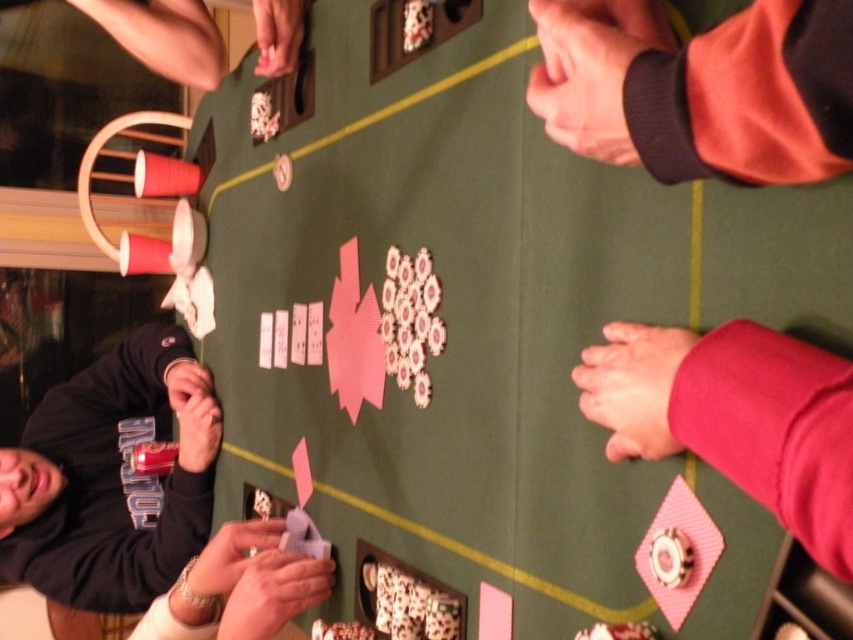
Does pink fabric hand at lower right come in front of smooth gray cards at lower center?

Yes, pink fabric hand at lower right is in front of smooth gray cards at lower center.

Is pink fabric hand at lower right smaller than smooth gray cards at lower center?

Indeed, pink fabric hand at lower right has a smaller size compared to smooth gray cards at lower center.

Between point (743, 451) and point (247, 600), which one is positioned behind?

Point (247, 600)

Identify the location of pink fabric hand at lower right. (735, 417).

Describe the element at coordinates (109, 477) in the screenshot. I see `black fabric shirt at lower left` at that location.

The width and height of the screenshot is (853, 640). Identify the location of black fabric shirt at lower left. (109, 477).

Where is `black fabric shirt at lower left`? black fabric shirt at lower left is located at coordinates (109, 477).

Who is taller, black fabric shirt at lower left or pink fabric hand at lower right?

With more height is black fabric shirt at lower left.

Who is more forward, [172,538] or [663,442]?

Point [663,442] is in front.

Between point (106, 483) and point (791, 474), which one is positioned in front?

Point (791, 474) is more forward.

At what (x,y) coordinates should I click in order to perform the action: click on black fabric shirt at lower left. Please return your answer as a coordinate pair (x, y). The width and height of the screenshot is (853, 640). Looking at the image, I should click on (109, 477).